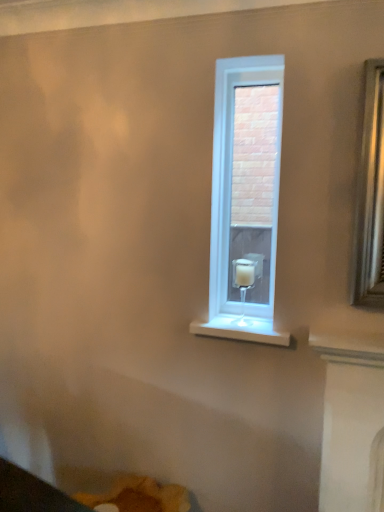
Locate an element on the screen. vacant area that is in front of white glass candle holder at center is located at coordinates (251, 332).